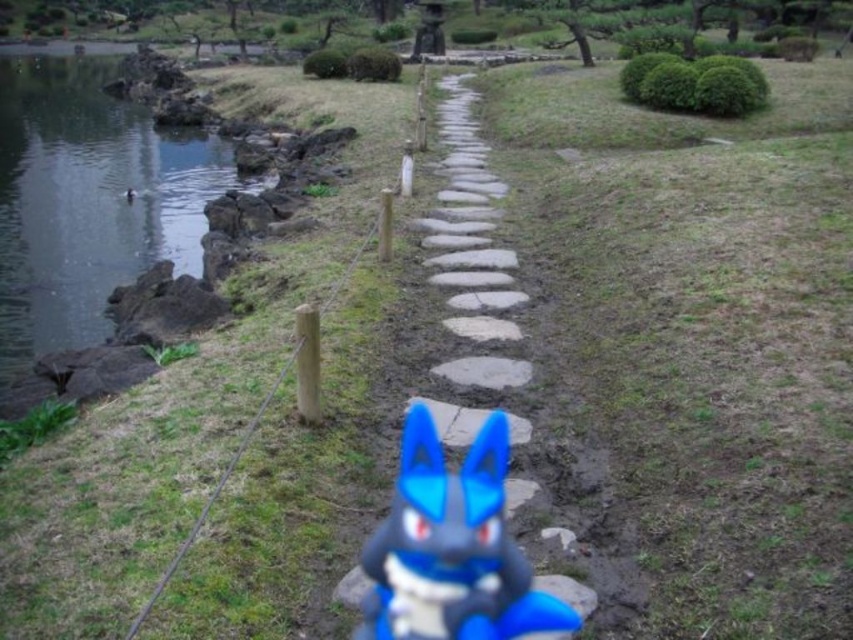
Question: Which of the following is the farthest from the observer?

Choices:
 (A) (103, 164)
 (B) (421, 476)
 (C) (505, 536)

Answer: (A)

Question: Observing the image, what is the correct spatial positioning of smooth stone lake at left in reference to smooth stone path at center?

Choices:
 (A) above
 (B) below

Answer: (A)

Question: Is smooth stone path at center positioned before blue plastic toy at center?

Choices:
 (A) yes
 (B) no

Answer: (B)

Question: Can you confirm if smooth stone lake at left is wider than blue plastic toy at center?

Choices:
 (A) yes
 (B) no

Answer: (A)

Question: Estimate the real-world distances between objects in this image. Which object is closer to the blue plastic toy at center?

Choices:
 (A) smooth stone path at center
 (B) smooth stone lake at left

Answer: (A)

Question: Which point is farther to the camera?

Choices:
 (A) (54, 260)
 (B) (425, 474)
 (C) (460, 260)

Answer: (A)